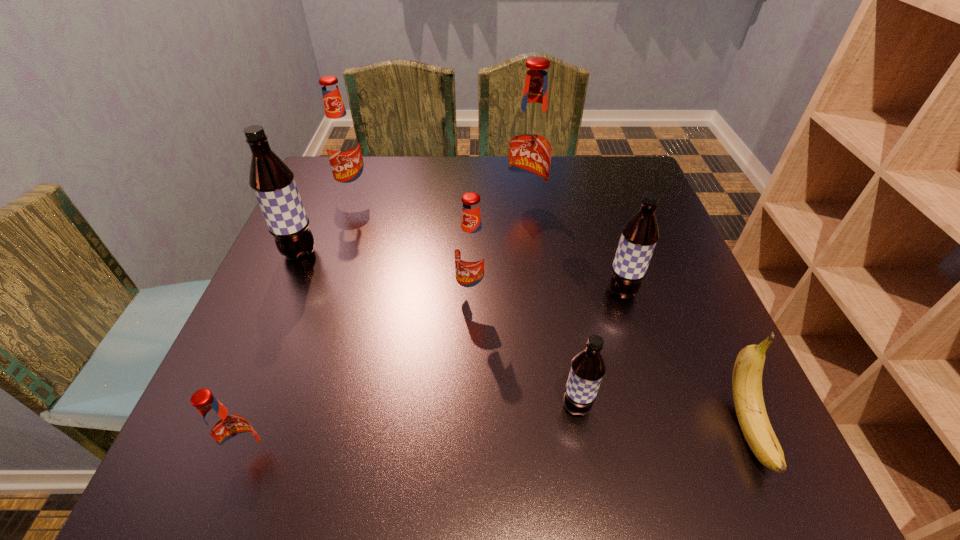
Identify the location of free location located on the right of the smallest red root beer. (327, 458).

Find the location of `free space located on the left of the nearest brown root beer`. free space located on the left of the nearest brown root beer is located at coordinates (440, 407).

I want to click on root beer present at the near edge, so click(x=230, y=433).

Locate an element on the screen. The width and height of the screenshot is (960, 540). banana present at the near edge is located at coordinates (748, 398).

The image size is (960, 540). Find the location of `root beer that is at the right edge`. root beer that is at the right edge is located at coordinates (639, 236).

Find the location of a particular element. This screenshot has height=540, width=960. banana positioned at the right edge is located at coordinates point(748,398).

Where is `object that is at the far left corner`? The height and width of the screenshot is (540, 960). object that is at the far left corner is located at coordinates (342, 142).

Where is `object that is at the near left corner`? The height and width of the screenshot is (540, 960). object that is at the near left corner is located at coordinates (230, 433).

Find the location of a particular element. object located in the near right corner section of the desktop is located at coordinates (748, 398).

Where is `blank space at the far edge`? This screenshot has width=960, height=540. blank space at the far edge is located at coordinates (446, 185).